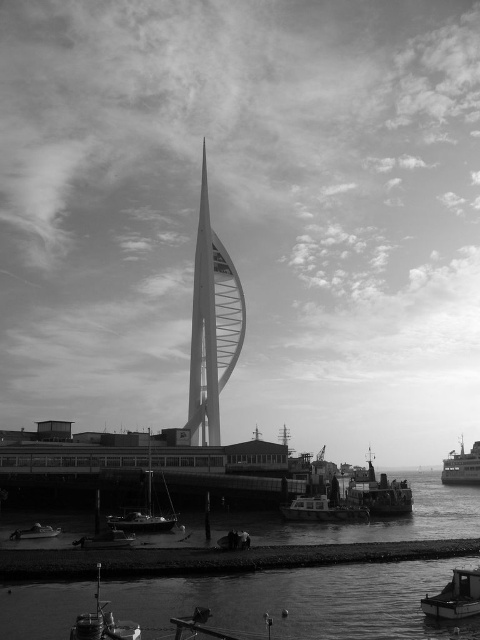
Is point (192, 365) positioned before point (359, 515)?

That is False.

Is smooth white spire at center bigger than metallic polished boat at lower center?

Yes.

Is point (207, 417) less distant than point (307, 509)?

That is False.

The height and width of the screenshot is (640, 480). In order to click on smooth white spire at center in this screenshot , I will do `click(212, 324)`.

Who is positioned more to the right, metallic polished boat at lower right or metallic polished boat at lower center?

From the viewer's perspective, metallic polished boat at lower right appears more on the right side.

Does metallic polished boat at lower right have a larger size compared to metallic polished boat at lower center?

No, metallic polished boat at lower right is not bigger than metallic polished boat at lower center.

Where is `metallic polished boat at lower right`? metallic polished boat at lower right is located at coordinates click(455, 596).

Locate an element on the screen. metallic polished boat at lower right is located at coordinates (455, 596).

Describe the element at coordinates (379, 492) in the screenshot. I see `rusty metal boat at lower right` at that location.

Who is taller, rusty metal boat at lower right or metallic gray ship at lower right?

rusty metal boat at lower right is taller.

Who is more distant from viewer, (375, 508) or (469, 465)?

Positioned behind is point (469, 465).

This screenshot has width=480, height=640. Find the location of `rusty metal boat at lower right`. rusty metal boat at lower right is located at coordinates (379, 492).